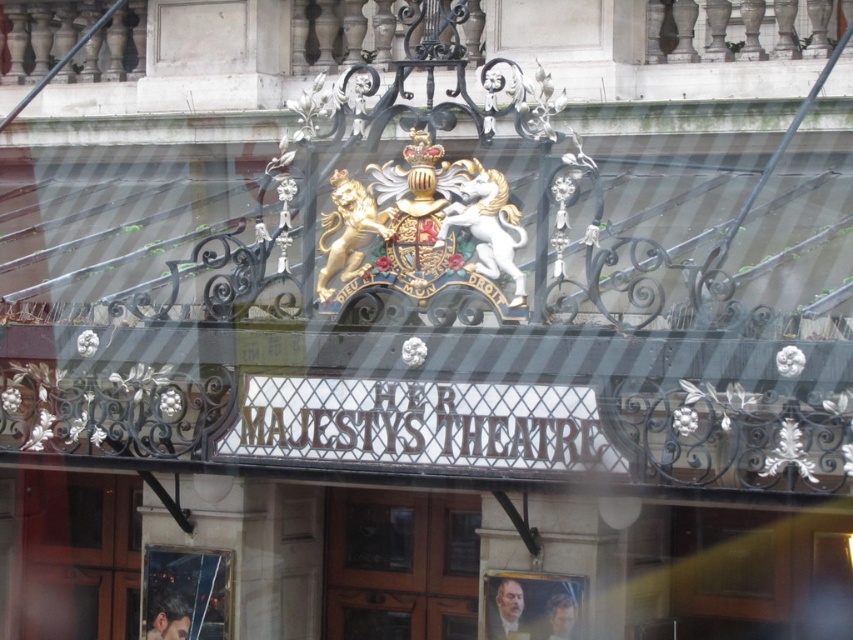
You are a visitor approaching the entrance of Her Majesty Theatre. You notice two glass elements near the bottom of the gate. Which one is bigger between the transparent glass window at lower left and the matte glass portrait at lower center?

The transparent glass window at lower left is larger in size than the matte glass portrait at lower center.

You are standing outside Her Majesty Theatre and want to see through the transparent glass window at lower left. Where should you position yourself to view it?

The transparent glass window at lower left is located at point (184, 593), so you should position yourself to the lower left side of the entrance to view it.